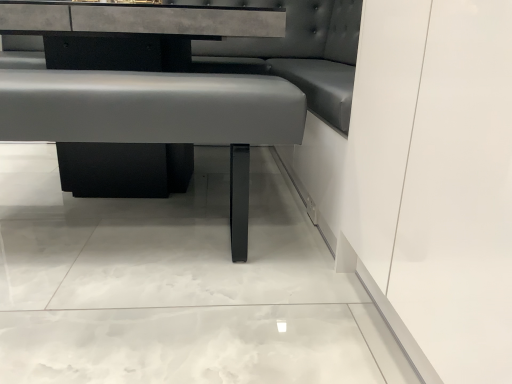
Question: From a real-world perspective, is satin black table at center over matte gray cushion at center?

Choices:
 (A) yes
 (B) no

Answer: (A)

Question: Is matte gray cushion at center surrounded by satin black table at center?

Choices:
 (A) no
 (B) yes

Answer: (B)

Question: Is satin black table at center smaller than matte gray cushion at center?

Choices:
 (A) yes
 (B) no

Answer: (B)

Question: Is satin black table at center oriented towards matte gray cushion at center?

Choices:
 (A) no
 (B) yes

Answer: (B)

Question: Does satin black table at center lie in front of matte gray cushion at center?

Choices:
 (A) no
 (B) yes

Answer: (A)

Question: Is satin black table at center directly adjacent to matte gray cushion at center?

Choices:
 (A) no
 (B) yes

Answer: (A)

Question: Is matte gray cushion at center to the left of satin black table at center from the viewer's perspective?

Choices:
 (A) yes
 (B) no

Answer: (B)

Question: Can satin black table at center be found inside matte gray cushion at center?

Choices:
 (A) no
 (B) yes

Answer: (A)

Question: From a real-world perspective, is matte gray cushion at center physically above satin black table at center?

Choices:
 (A) yes
 (B) no

Answer: (B)

Question: Is matte gray cushion at center next to satin black table at center?

Choices:
 (A) no
 (B) yes

Answer: (A)

Question: Would you say matte gray cushion at center is a long distance from satin black table at center?

Choices:
 (A) yes
 (B) no

Answer: (B)

Question: Does matte gray cushion at center have a greater width compared to satin black table at center?

Choices:
 (A) no
 (B) yes

Answer: (A)

Question: Is satin black table at center wider or thinner than matte gray cushion at center?

Choices:
 (A) wide
 (B) thin

Answer: (A)